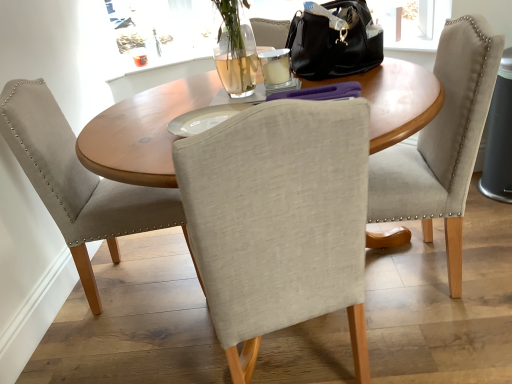
At what (x,y) coordinates should I click in order to perform the action: click on black leather handbag at upper center. Please return your answer as a coordinate pair (x, y). Looking at the image, I should click on (334, 41).

Where is `wooden table at center`? The height and width of the screenshot is (384, 512). wooden table at center is located at coordinates (141, 132).

Does black leather handbag at upper center lie behind light gray fabric chair at center, acting as the 2th chair starting from the left?

Yes, the depth of black leather handbag at upper center is greater than that of light gray fabric chair at center, acting as the 2th chair starting from the left.

From the image's perspective, is black leather handbag at upper center positioned above or below light gray fabric chair at center, which appears as the 1th chair when viewed from the right?

black leather handbag at upper center is situated higher than light gray fabric chair at center, which appears as the 1th chair when viewed from the right, in the image.

Considering the relative sizes of light gray fabric chair at left, the 2th chair positioned from the right, and black leather handbag at upper center in the image provided, is light gray fabric chair at left, the 2th chair positioned from the right, smaller than black leather handbag at upper center?

Actually, light gray fabric chair at left, the 2th chair positioned from the right, might be larger than black leather handbag at upper center.

Considering the relative sizes of light gray fabric chair at left, the 2th chair positioned from the right, and black leather handbag at upper center in the image provided, is light gray fabric chair at left, the 2th chair positioned from the right, shorter than black leather handbag at upper center?

No.

From the image's perspective, which one is positioned lower, light gray fabric chair at left, placed as the 1th chair when sorted from left to right, or black leather handbag at upper center?

light gray fabric chair at left, placed as the 1th chair when sorted from left to right, from the image's perspective.

How much distance is there between light gray fabric chair at left, placed as the 1th chair when sorted from left to right, and black leather handbag at upper center?

light gray fabric chair at left, placed as the 1th chair when sorted from left to right, is 34.51 inches away from black leather handbag at upper center.

What's the angular difference between light gray fabric chair at center, which appears as the 1th chair when viewed from the right, and light gray fabric chair at left, the 2th chair positioned from the right,'s facing directions?

175 degrees separate the facing orientations of light gray fabric chair at center, which appears as the 1th chair when viewed from the right, and light gray fabric chair at left, the 2th chair positioned from the right.

At what (x,y) coordinates should I click in order to perform the action: click on chair lying on the left of light gray fabric chair at center, which appears as the 1th chair when viewed from the right. Please return your answer as a coordinate pair (x, y). Looking at the image, I should click on (78, 181).

Is light gray fabric chair at center, acting as the 2th chair starting from the left, situated inside light gray fabric chair at left, the 2th chair positioned from the right, or outside?

light gray fabric chair at center, acting as the 2th chair starting from the left, is not enclosed by light gray fabric chair at left, the 2th chair positioned from the right.

From a real-world perspective, is light gray fabric chair at center, which appears as the 1th chair when viewed from the right, positioned under light gray fabric chair at left, the 2th chair positioned from the right, based on gravity?

Incorrect, from a real-world perspective, light gray fabric chair at center, which appears as the 1th chair when viewed from the right, is higher than light gray fabric chair at left, the 2th chair positioned from the right.

From a real-world perspective, which object rests below the other?

wooden table at center.

Looking at their sizes, would you say wooden table at center is wider or thinner than black leather handbag at upper center?

wooden table at center is wider than black leather handbag at upper center.

Could black leather handbag at upper center be considered to be inside wooden table at center?

That's incorrect, black leather handbag at upper center is not inside wooden table at center.

Considering the sizes of objects light gray fabric chair at left, the 2th chair positioned from the right, and light gray fabric chair at center, which appears as the 1th chair when viewed from the right, in the image provided, who is thinner, light gray fabric chair at left, the 2th chair positioned from the right, or light gray fabric chair at center, which appears as the 1th chair when viewed from the right,?

With smaller width is light gray fabric chair at center, which appears as the 1th chair when viewed from the right.

Which is in front, point (28, 142) or point (451, 129)?

The point (451, 129) is closer to the camera.

Which is more to the left, light gray fabric chair at left, placed as the 1th chair when sorted from left to right, or light gray fabric chair at center, which appears as the 1th chair when viewed from the right?

From the viewer's perspective, light gray fabric chair at left, placed as the 1th chair when sorted from left to right, appears more on the left side.

The height and width of the screenshot is (384, 512). Identify the location of chair on the right of light gray fabric chair at left, placed as the 1th chair when sorted from left to right. (442, 143).

Is wooden table at center touching light gray fabric chair at center, acting as the 2th chair starting from the left?

No, wooden table at center is not in contact with light gray fabric chair at center, acting as the 2th chair starting from the left.

This screenshot has width=512, height=384. In order to click on kitchen & dining room table that appears below the light gray fabric chair at center, acting as the 2th chair starting from the left (from the image's perspective) in this screenshot , I will do `click(141, 132)`.

Does wooden table at center turn towards light gray fabric chair at center, which appears as the 1th chair when viewed from the right?

No, wooden table at center is not turned towards light gray fabric chair at center, which appears as the 1th chair when viewed from the right.

Can you confirm if light gray fabric chair at left, placed as the 1th chair when sorted from left to right, is wider than wooden table at center?

Yes.

Which object is positioned more to the right, light gray fabric chair at left, placed as the 1th chair when sorted from left to right, or wooden table at center?

Positioned to the right is wooden table at center.

Where is `kitchen & dining room table below the light gray fabric chair at left, the 2th chair positioned from the right (from the image's perspective)`? The image size is (512, 384). kitchen & dining room table below the light gray fabric chair at left, the 2th chair positioned from the right (from the image's perspective) is located at coordinates (141, 132).

Based on the photo, from the image's perspective, who appears lower, light gray fabric chair at left, placed as the 1th chair when sorted from left to right, or wooden table at center?

wooden table at center appears lower in the image.

From a real-world perspective, count 1st chairs downward from the black leather handbag at upper center and point to it. Please provide its 2D coordinates.

[(442, 143)]

Locate an element on the screen. Image resolution: width=512 pixels, height=384 pixels. handbag above the light gray fabric chair at left, the 2th chair positioned from the right (from the image's perspective) is located at coordinates (334, 41).

Looking at the image, which one is located further to light gray fabric chair at center, acting as the 2th chair starting from the left, light gray fabric chair at left, placed as the 1th chair when sorted from left to right, or black leather handbag at upper center?

light gray fabric chair at left, placed as the 1th chair when sorted from left to right, lies further to light gray fabric chair at center, acting as the 2th chair starting from the left, than the other object.

When comparing their distances from light gray fabric chair at left, the 2th chair positioned from the right, does black leather handbag at upper center or wooden table at center seem closer?

wooden table at center is closer to light gray fabric chair at left, the 2th chair positioned from the right.

Considering their positions, is light gray fabric chair at left, the 2th chair positioned from the right, positioned further to black leather handbag at upper center than light gray fabric chair at center, which appears as the 1th chair when viewed from the right?

light gray fabric chair at left, the 2th chair positioned from the right, is positioned further to the anchor black leather handbag at upper center.

When comparing their distances from black leather handbag at upper center, does wooden table at center or light gray fabric chair at left, placed as the 1th chair when sorted from left to right, seem closer?

wooden table at center is positioned closer to the anchor black leather handbag at upper center.

When comparing their distances from light gray fabric chair at center, which appears as the 1th chair when viewed from the right, does black leather handbag at upper center or light gray fabric chair at left, placed as the 1th chair when sorted from left to right, seem closer?

Among the two, black leather handbag at upper center is located nearer to light gray fabric chair at center, which appears as the 1th chair when viewed from the right.

Estimate the real-world distances between objects in this image. Which object is further from light gray fabric chair at left, the 2th chair positioned from the right, light gray fabric chair at center, acting as the 2th chair starting from the left, or black leather handbag at upper center?

light gray fabric chair at center, acting as the 2th chair starting from the left, is further to light gray fabric chair at left, the 2th chair positioned from the right.

Looking at the image, which one is located closer to black leather handbag at upper center, light gray fabric chair at center, acting as the 2th chair starting from the left, or light gray fabric chair at left, placed as the 1th chair when sorted from left to right?

Among the two, light gray fabric chair at center, acting as the 2th chair starting from the left, is located nearer to black leather handbag at upper center.

Considering their positions, is wooden table at center positioned further to light gray fabric chair at left, the 2th chair positioned from the right, than light gray fabric chair at center, acting as the 2th chair starting from the left?

The object further to light gray fabric chair at left, the 2th chair positioned from the right, is light gray fabric chair at center, acting as the 2th chair starting from the left.

This screenshot has height=384, width=512. I want to click on kitchen & dining room table located between light gray fabric chair at left, the 2th chair positioned from the right, and black leather handbag at upper center in the left-right direction, so click(x=141, y=132).

The height and width of the screenshot is (384, 512). What are the coordinates of `kitchen & dining room table located between light gray fabric chair at left, placed as the 1th chair when sorted from left to right, and light gray fabric chair at center, which appears as the 1th chair when viewed from the right, in the left-right direction` in the screenshot? It's located at point(141,132).

Image resolution: width=512 pixels, height=384 pixels. I want to click on handbag situated between light gray fabric chair at left, placed as the 1th chair when sorted from left to right, and light gray fabric chair at center, acting as the 2th chair starting from the left, from left to right, so click(334, 41).